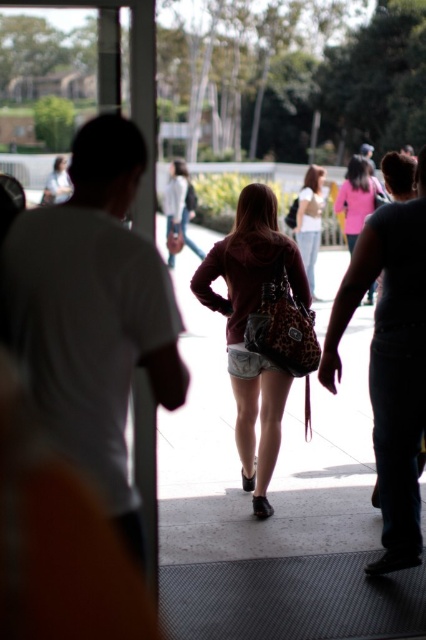
Consider the image. You are standing at the entrance and want to place a small potted plant on the matte gray pavement at center so that it is visible to people approaching the leopard print bag at center. Will the plant be visible to them?

The matte gray pavement at center is further to the viewer than leopard print bag at center, so the plant placed there would be closer to the viewer and might block the view of the leopard print bag at center for those approaching it.